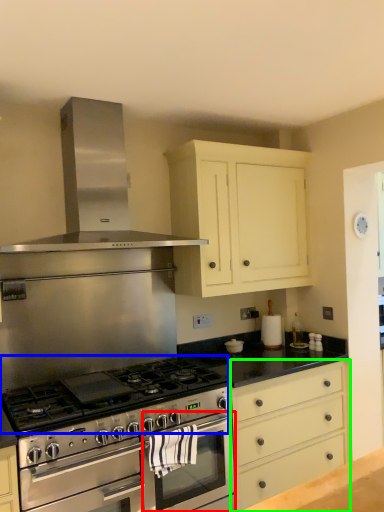
Question: Which object is the farthest from oven (highlighted by a red box)? Choose among these: gas stove (highlighted by a blue box) or drawer (highlighted by a green box).

Choices:
 (A) gas stove
 (B) drawer

Answer: (B)